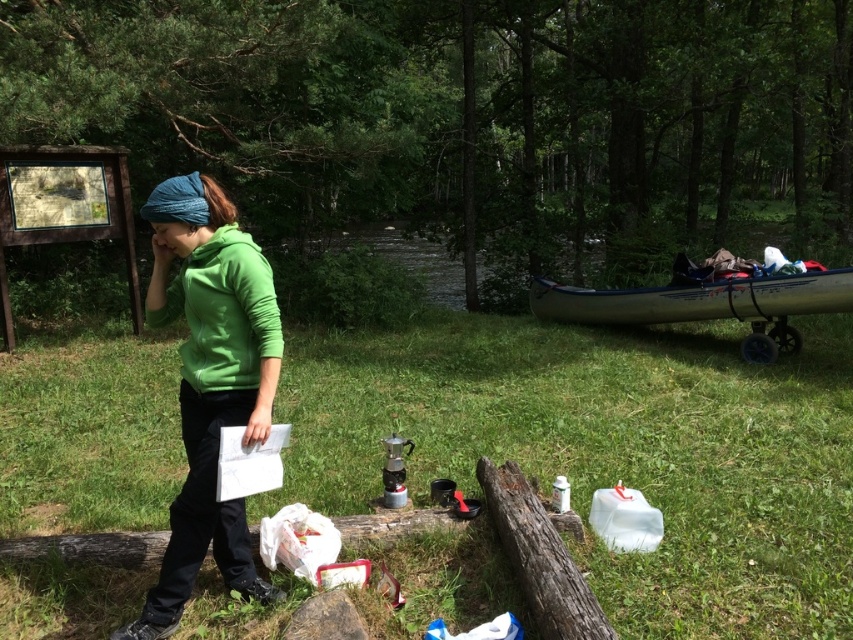
You are a hiker who has just arrived at the campsite and needs to decide where to place your gear. You have a green fleece jacket at center and a blue plastic canoe at right. Which item takes up more space in the campsite?

The blue plastic canoe at right takes up more space because it is larger than the green fleece jacket at center.

Looking at this image, you are a hiker who needs to place your green fleece jacket at center on top of the rough wooden log at lower center. Can you do this without moving any other items on the log?

The green fleece jacket at center is already to the left of the rough wooden log at lower center, so you can place it on the log without moving other items.